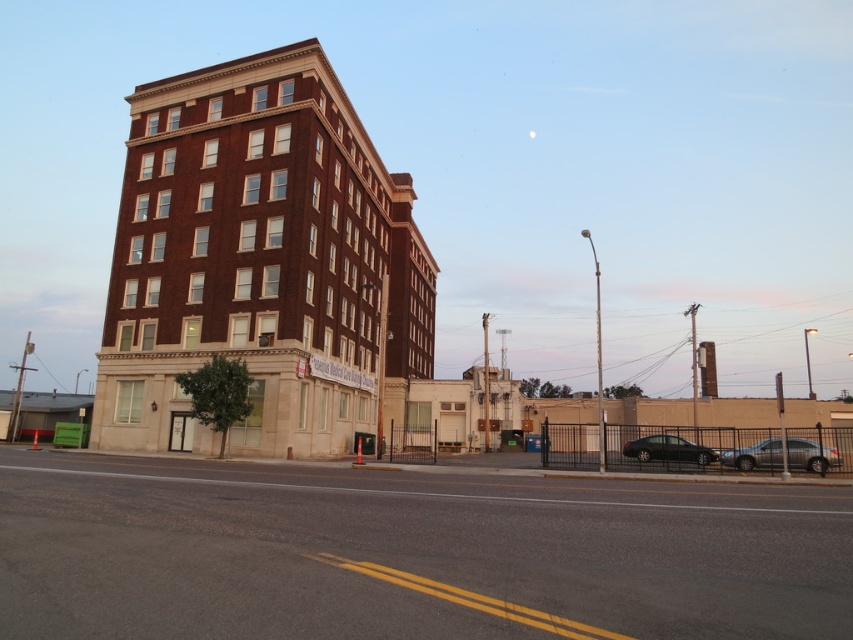
You are a delivery driver who needs to park your satin silver sedan at lower right near the multi story brick building on the left. The parking spot is marked by the point at coordinates [755,456]. Is the parking spot near the building?

The point at coordinates [755,456] indicates the satin silver sedan at lower right, which is parked near the multi story brick building on the left. Therefore, the parking spot is indeed near the building.

You are a delivery person trying to park your 2.5 meters wide delivery van between the satin silver sedan at lower right and the black glossy sedan at lower right. Based on the scene, can you fit your van there?

The satin silver sedan at lower right is larger than the black glossy sedan at lower right, so the space between them may be insufficient for a 2.5 meters wide delivery van. You should look for another parking spot.